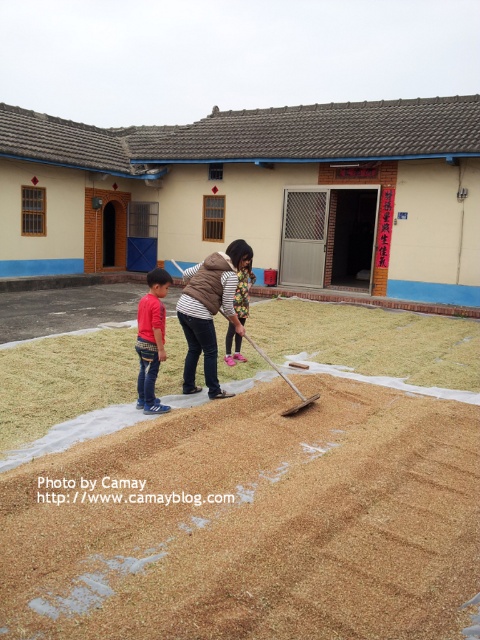
Is brown grainy sand at lower center to the left of red cotton shirt at lower left from the viewer's perspective?

Incorrect, brown grainy sand at lower center is not on the left side of red cotton shirt at lower left.

Between brown grainy sand at lower center and red cotton shirt at lower left, which one appears on the left side from the viewer's perspective?

red cotton shirt at lower left is more to the left.

Which is in front, point (347, 426) or point (155, 314)?

Positioned in front is point (347, 426).

Image resolution: width=480 pixels, height=640 pixels. Find the location of `brown grainy sand at lower center`. brown grainy sand at lower center is located at coordinates (252, 522).

Which is in front, point (296, 428) or point (210, 284)?

Point (296, 428)

Who is more forward, (66,609) or (192,307)?

Point (66,609)

Locate an element on the screen. brown grainy sand at lower center is located at coordinates (252, 522).

Who is taller, brown woolen vest at center or red cotton shirt at lower left?

With more height is brown woolen vest at center.

What do you see at coordinates (208, 310) in the screenshot?
I see `brown woolen vest at center` at bounding box center [208, 310].

Does point (197, 280) come behind point (160, 268)?

No, it is not.

You are a GUI agent. You are given a task and a screenshot of the screen. Output one action in this format:
    pyautogui.click(x=<x>, y=<y>)
    Task: Click on the brown woolen vest at center
    
    Given the screenshot: What is the action you would take?
    pyautogui.click(x=208, y=310)